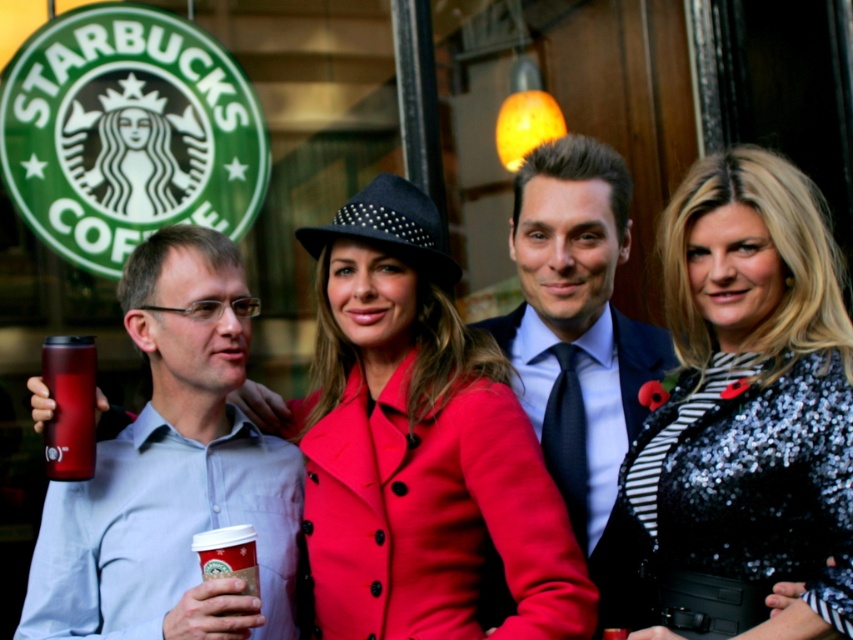
Question: Is matte red tumbler at left further to the viewer compared to cardboard cup at center?

Choices:
 (A) yes
 (B) no

Answer: (A)

Question: Where is shiny blue suit at center located in relation to matte red tumbler at left in the image?

Choices:
 (A) below
 (B) above

Answer: (B)

Question: Which of these objects is positioned farthest from the sequined black dress at center?

Choices:
 (A) matte red coat at center
 (B) matte plastic cup at left
 (C) matte red tumbler at left

Answer: (C)

Question: Is sequined black dress at center positioned in front of cardboard cup at center?

Choices:
 (A) yes
 (B) no

Answer: (A)

Question: Which point appears farthest from the camera in this image?

Choices:
 (A) (457, 608)
 (B) (88, 467)

Answer: (A)

Question: Which is nearer to the matte plastic cup at left?

Choices:
 (A) matte red tumbler at left
 (B) shiny blue suit at center
 (C) matte red coat at center
 (D) cardboard cup at center

Answer: (A)